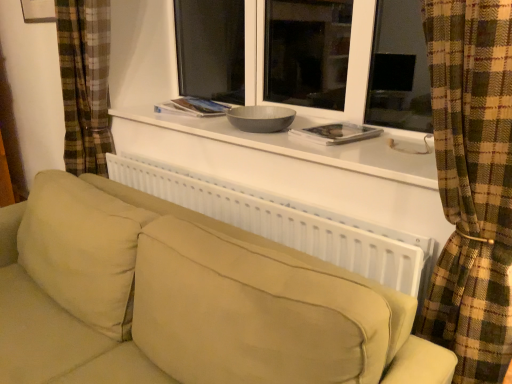
You are a GUI agent. You are given a task and a screenshot of the screen. Output one action in this format:
    pyautogui.click(x=<x>, y=<y>)
    Task: Click on the free space in front of white paper book at center, which ranks as the 1th book in right-to-left order
    
    Given the screenshot: What is the action you would take?
    pyautogui.click(x=354, y=147)